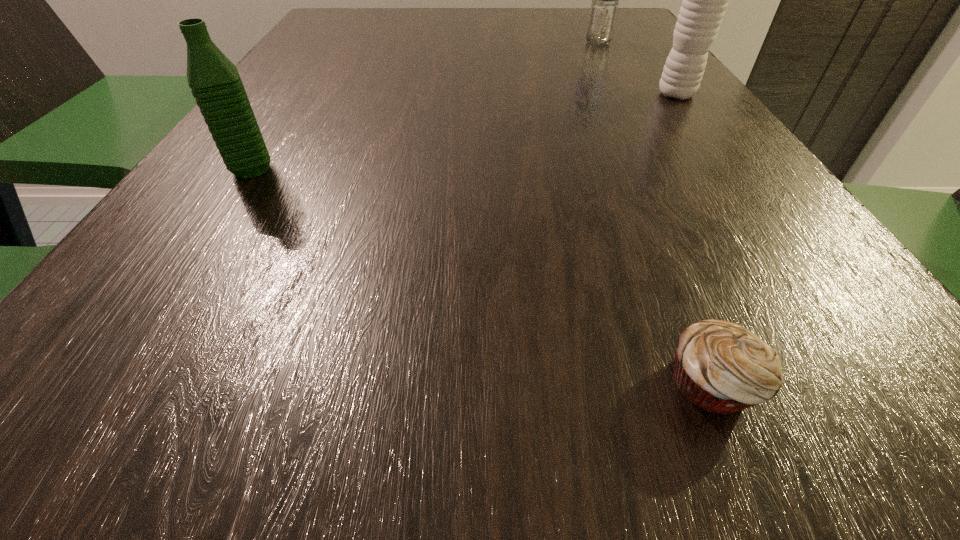
This screenshot has width=960, height=540. In order to click on free space at the left edge in this screenshot , I will do `click(165, 295)`.

Locate an element on the screen. The width and height of the screenshot is (960, 540). vacant space at the right edge of the desktop is located at coordinates (818, 309).

The image size is (960, 540). I want to click on vacant space at the far left corner, so click(x=336, y=9).

Where is `vacant space at the far right corner of the desktop`? Image resolution: width=960 pixels, height=540 pixels. vacant space at the far right corner of the desktop is located at coordinates (636, 24).

Where is `blank region between the leftmost water bottle and the farthest water bottle`? The height and width of the screenshot is (540, 960). blank region between the leftmost water bottle and the farthest water bottle is located at coordinates (425, 106).

At what (x,y) coordinates should I click in order to perform the action: click on free space between the rightmost water bottle and the leftmost object. Please return your answer as a coordinate pair (x, y). The height and width of the screenshot is (540, 960). Looking at the image, I should click on (465, 132).

Where is `free spot between the rightmost object and the second water bottle from right to left`? The height and width of the screenshot is (540, 960). free spot between the rightmost object and the second water bottle from right to left is located at coordinates (637, 69).

The width and height of the screenshot is (960, 540). I want to click on free point between the nearest water bottle and the nearest object, so click(x=482, y=276).

Find the location of a particular element. This screenshot has width=960, height=540. free spot between the nearest object and the leftmost water bottle is located at coordinates (482, 276).

Identify the location of free space that is in between the nearest water bottle and the rightmost object. The image size is (960, 540). (465, 132).